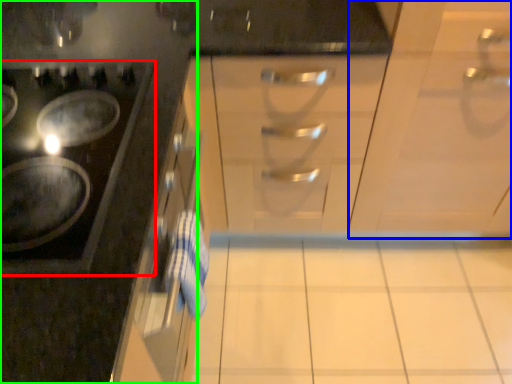
Question: Which is farther away from gas stove (highlighted by a red box)? cabinetry (highlighted by a blue box) or cabinetry (highlighted by a green box)?

Choices:
 (A) cabinetry
 (B) cabinetry

Answer: (A)